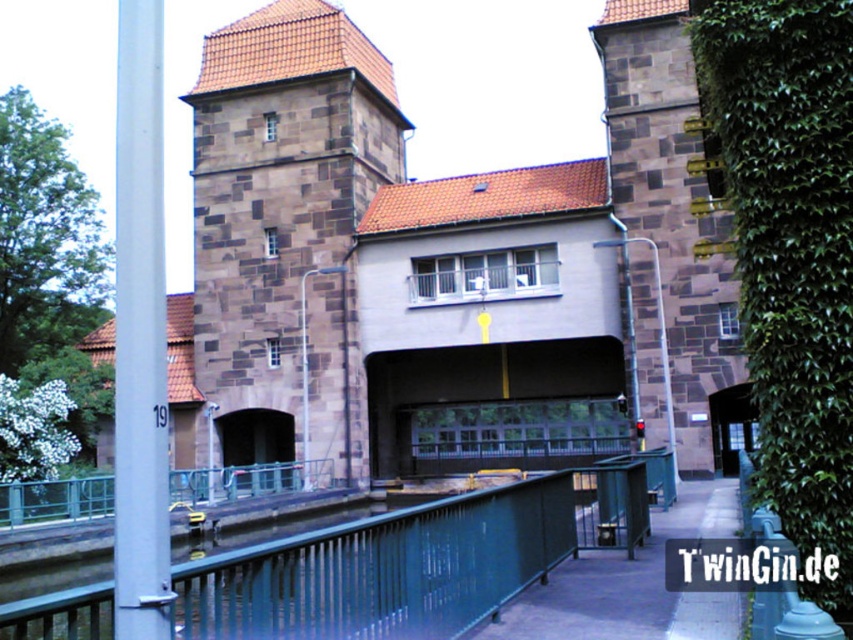
Question: Can you confirm if green metallic railing at center is smaller than brown stone bell tower at right?

Choices:
 (A) no
 (B) yes

Answer: (A)

Question: Which point is closer to the camera?

Choices:
 (A) (643, 26)
 (B) (223, 164)
 (C) (799, 260)

Answer: (C)

Question: Which object appears closest to the camera in this image?

Choices:
 (A) green leafy ivy at right
 (B) brown stone bell tower at center
 (C) green metallic railing at center

Answer: (C)

Question: Which object is positioned closest to the green leafy ivy at right?

Choices:
 (A) brown stone bell tower at right
 (B) brown stone bell tower at center
 (C) green metallic railing at center

Answer: (C)

Question: Can you confirm if green leafy ivy at right is positioned to the right of green metallic railing at center?

Choices:
 (A) no
 (B) yes

Answer: (B)

Question: Is brown stone bell tower at center above green metallic railing at center?

Choices:
 (A) no
 (B) yes

Answer: (B)